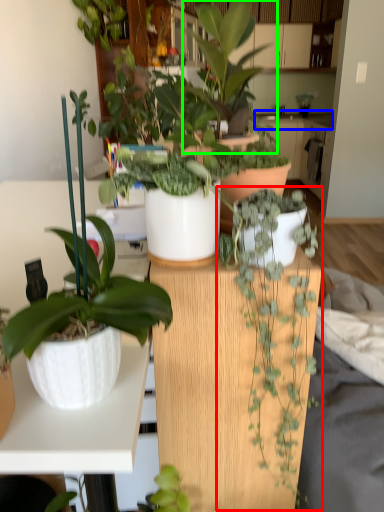
Question: Which object is the farthest from houseplant (highlighted by a red box)? Choose among these: counter top (highlighted by a blue box) or houseplant (highlighted by a green box).

Choices:
 (A) counter top
 (B) houseplant

Answer: (A)